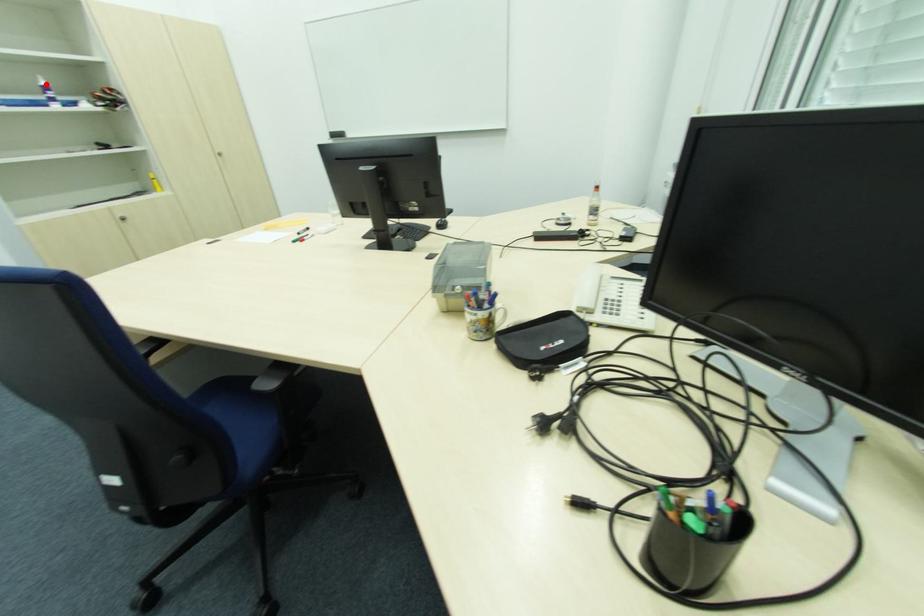
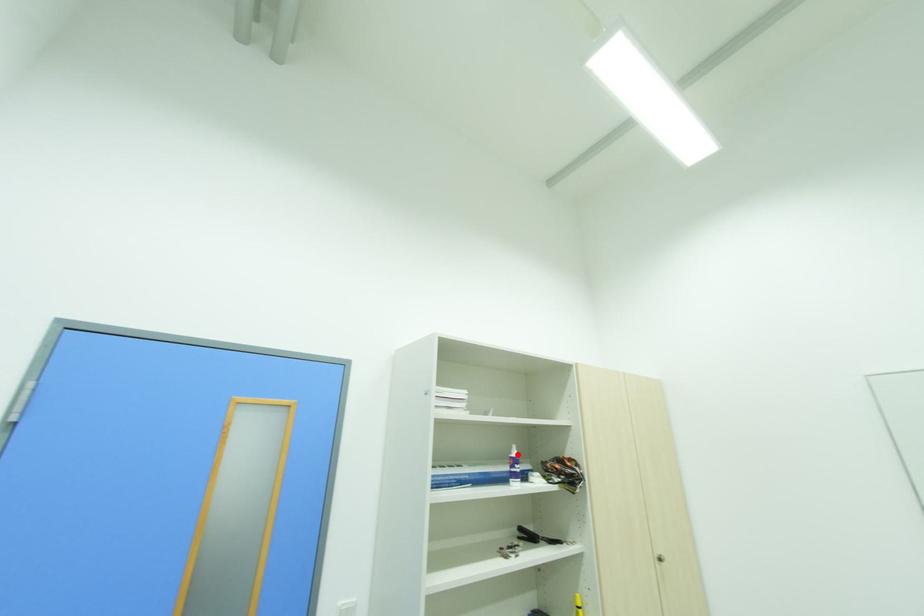
I am providing you with two images of the same scene from different viewpoints. A red point is marked on the first image and another point is marked on the second image. Is the marked point in image1 the same physical position as the marked point in image2?

Yes